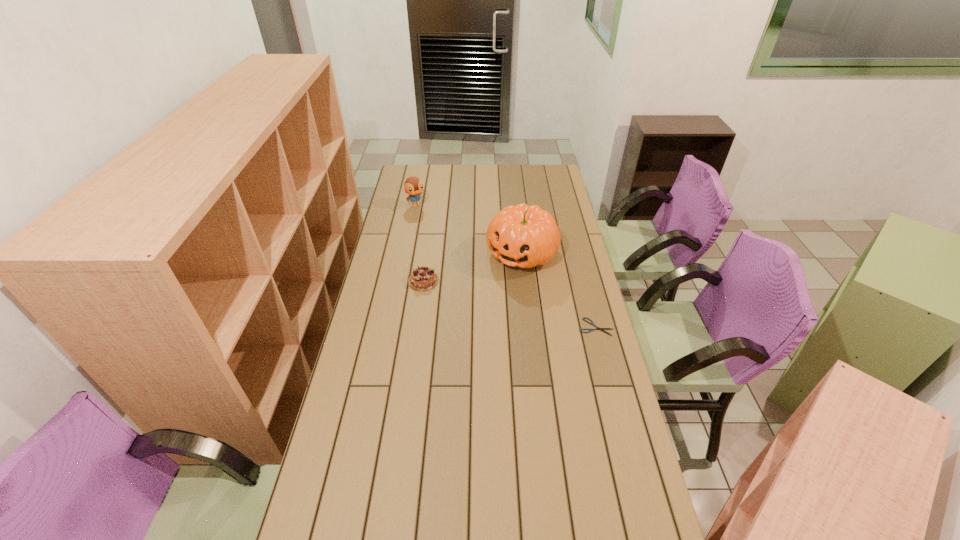
At what (x,y) coordinates should I click in order to perform the action: click on chocolate cake. Please return your answer as a coordinate pair (x, y). The height and width of the screenshot is (540, 960). Looking at the image, I should click on (422, 279).

The image size is (960, 540). Find the location of `shears`. shears is located at coordinates (597, 328).

I want to click on the rightmost object, so click(597, 328).

The image size is (960, 540). In order to click on the tallest object in this screenshot , I will do `click(525, 236)`.

Locate an element on the screen. Image resolution: width=960 pixels, height=540 pixels. pumpkin is located at coordinates point(525,236).

Where is `duck`? Image resolution: width=960 pixels, height=540 pixels. duck is located at coordinates (413, 186).

The image size is (960, 540). I want to click on the third shortest object, so click(x=413, y=186).

The height and width of the screenshot is (540, 960). I want to click on free space located on the back of the chocolate cake, so click(x=432, y=221).

The height and width of the screenshot is (540, 960). Find the location of `vacant space located 0.160m on the front of the rightmost object`. vacant space located 0.160m on the front of the rightmost object is located at coordinates (608, 373).

Identify the location of free region located on the carved face of the tallest object. (490, 290).